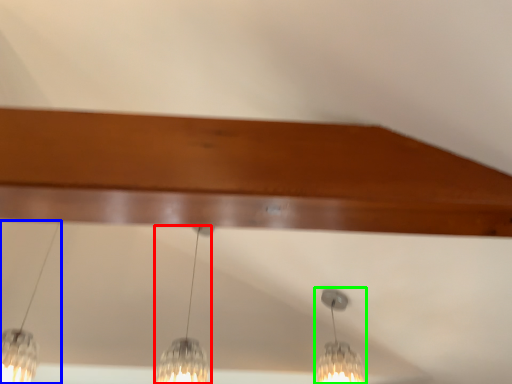
Question: Which object is the closest to the lamp (highlighted by a red box)? Choose among these: lamp (highlighted by a blue box) or lamp (highlighted by a green box).

Choices:
 (A) lamp
 (B) lamp

Answer: (A)